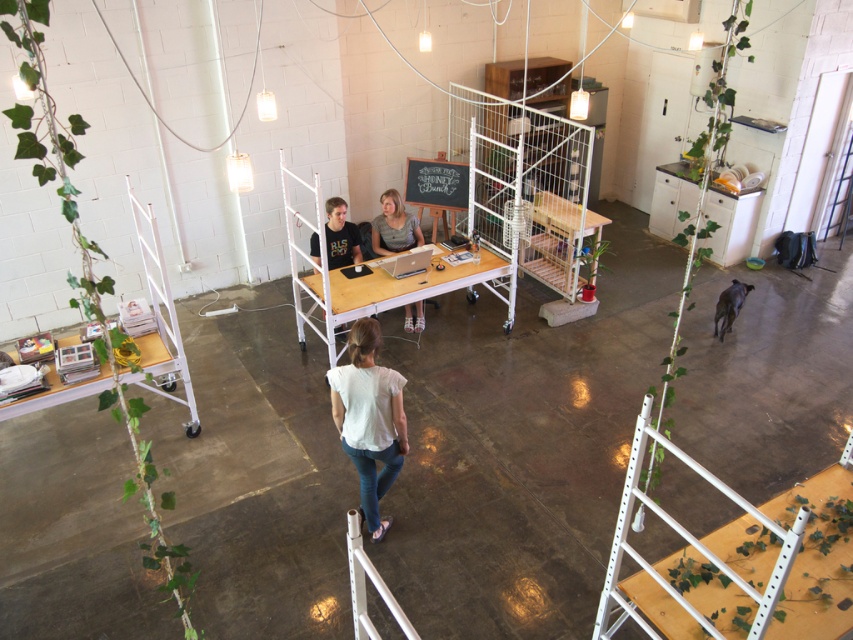
From the picture: Is the position of white wire mesh cage at upper center less distant than that of matte black laptop at center?

That is False.

Is point (538, 172) in front of point (381, 212)?

No.

Is point (517, 228) behind point (384, 253)?

No.

Where is `white wire mesh cage at upper center`? This screenshot has width=853, height=640. white wire mesh cage at upper center is located at coordinates (525, 186).

How distant is white wire mesh cage at upper center from chalkboard at center?

A distance of 1.25 meters exists between white wire mesh cage at upper center and chalkboard at center.

Between white wire mesh cage at upper center and chalkboard at center, which one is positioned lower?

chalkboard at center is lower down.

Does point (543, 172) lie behind point (430, 164)?

Yes, point (543, 172) is behind point (430, 164).

The width and height of the screenshot is (853, 640). I want to click on white wire mesh cage at upper center, so click(x=525, y=186).

Does wooden table at lower left have a greater width compared to chalkboard at center?

Indeed, wooden table at lower left has a greater width compared to chalkboard at center.

Is point (61, 392) farther from viewer compared to point (454, 163)?

That is False.

At what (x,y) coordinates should I click in order to perform the action: click on wooden table at lower left. Please return your answer as a coordinate pair (x, y). Image resolution: width=853 pixels, height=640 pixels. Looking at the image, I should click on (164, 365).